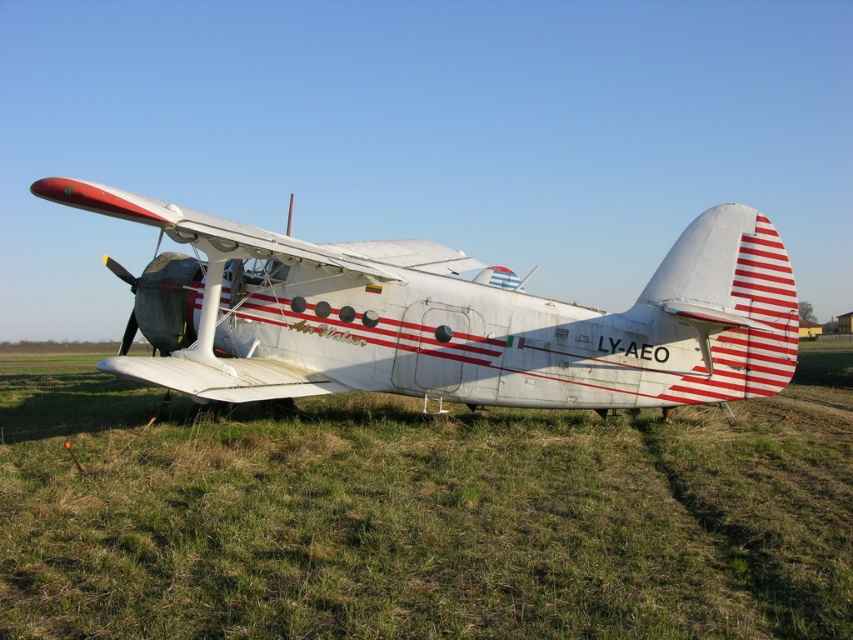
You are standing at the point marked by the coordinates point [421,515] in the image. What is the terrain like under your feet?

The point [421,515] marks green grass at lower center, so the terrain under your feet is green grass.

You are standing in front of the vintage biplane and want to place a small flag exactly where the green grass at lower center is located. According to the coordinates provided, where should you place the flag?

You should place the flag at the coordinates point (421, 515) where the green grass at lower center is located.

You are standing on the green grass at lower center and want to board the white matte airplane at center. Which direction should you move to reach the airplane?

Since the green grass at lower center is closer to the viewer than the white matte airplane at center, you should move forward towards the airplane to reach it.